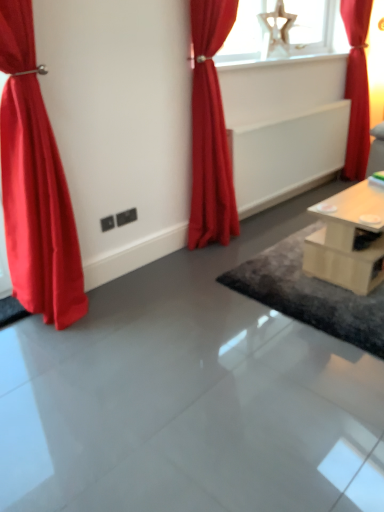
The height and width of the screenshot is (512, 384). Identify the location of vacant space in matte red curtain at left, which ranks as the third curtain in right-to-left order (from a real-world perspective). (57, 327).